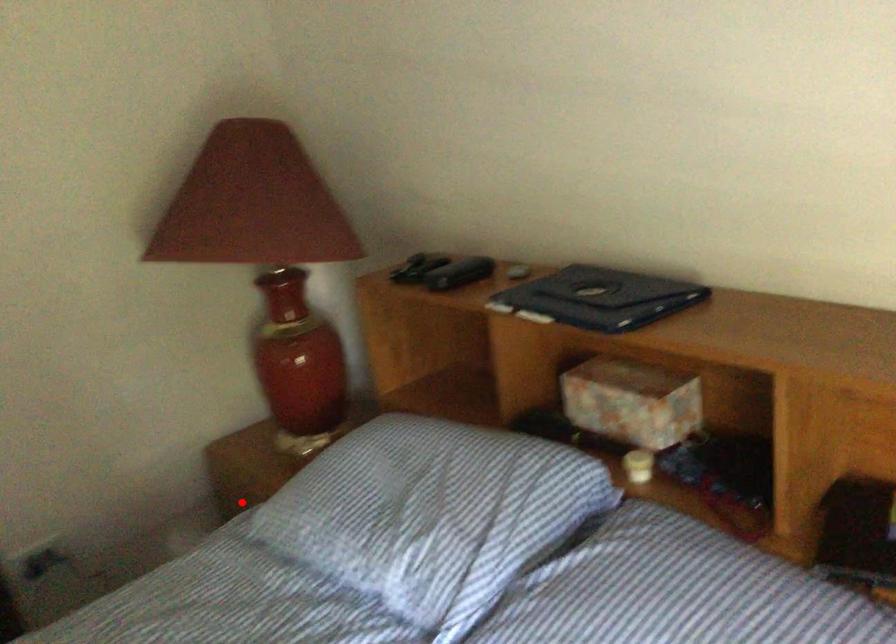
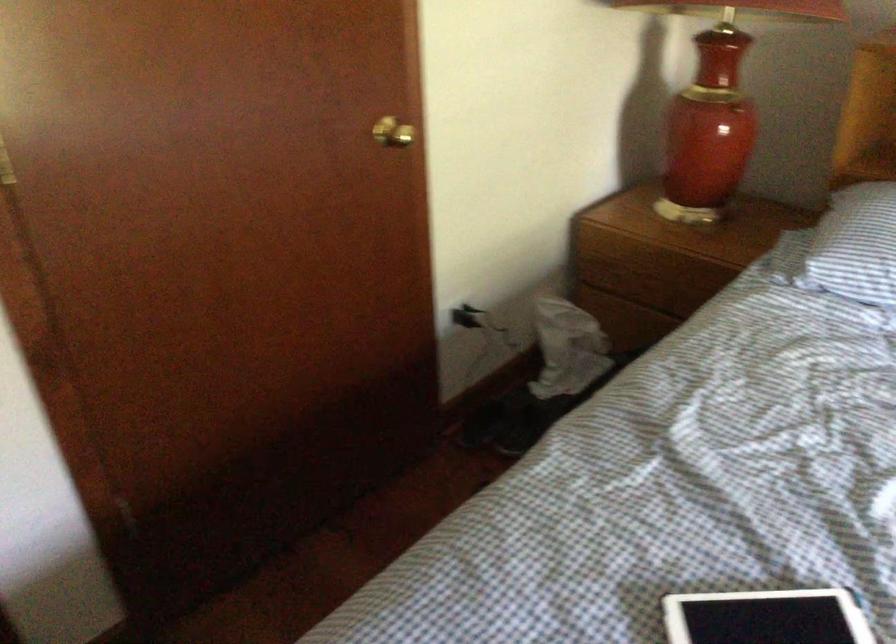
Find the pixel in the second image that matches the highlighted location in the first image.

(650, 283)